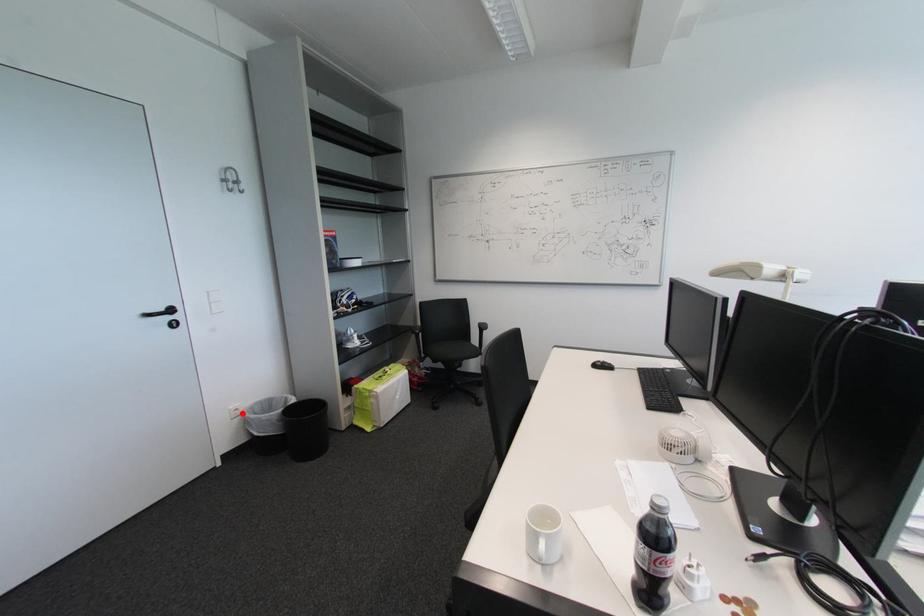
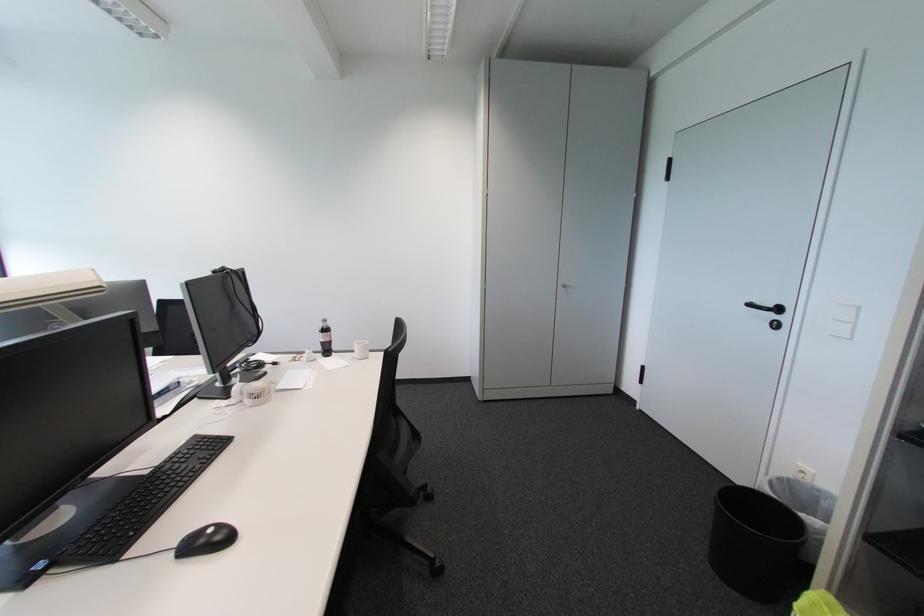
Find the pixel in the second image that matches the highlighted location in the first image.

(809, 477)